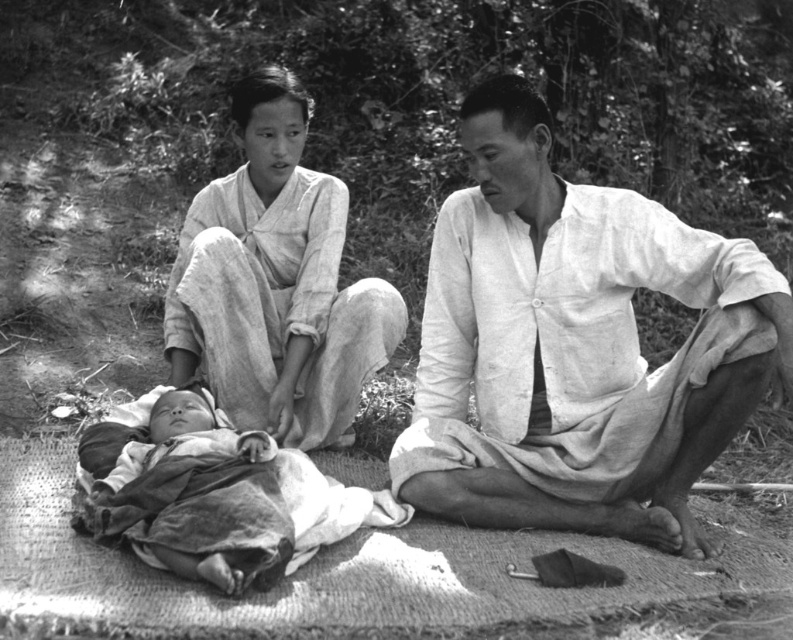
You are a photographer analyzing this black and white image. You notice two light beige fabrics in the scene. The first is the light beige fabric shirt at center, and the second is the light beige fabric at upper left. Which of these fabrics appears bigger in the photo?

The light beige fabric shirt at center appears bigger in the photo than the light beige fabric at upper left.

You are standing in the scene and need to locate the light beige fabric shirt at center. According to the coordinates provided, where would you find it?

The light beige fabric shirt at center is located at point 0.542 on the x axis and 0.728 on the y axis.

You are a photographer analyzing this black and white photo. You notice two light beige fabrics in the scene. The first is the light beige fabric shirt at center and the second is the light beige fabric at upper left. Which one is closer to the camera?

The light beige fabric shirt at center is positioned under the light beige fabric at upper left, so the light beige fabric at upper left is closer to the camera.